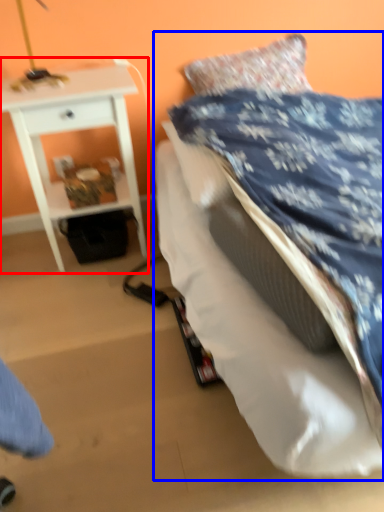
Question: Which object is further to the camera taking this photo, nightstand (highlighted by a red box) or bed (highlighted by a blue box)?

Choices:
 (A) nightstand
 (B) bed

Answer: (A)